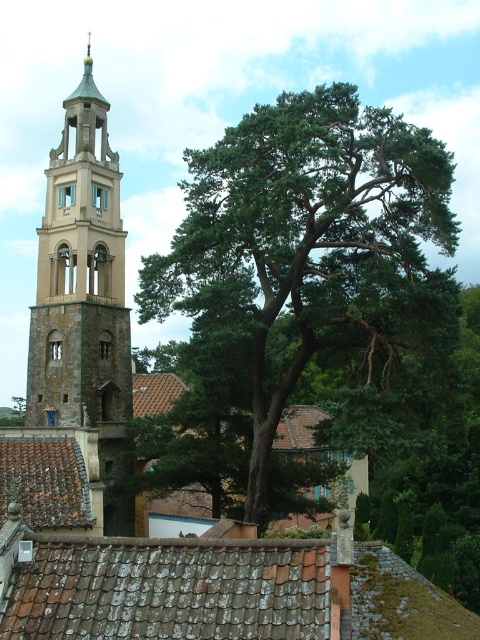
Is point (231, 205) farther from viewer compared to point (35, 348)?

That is False.

Who is more distant from viewer, [374,340] or [84,266]?

Point [84,266]

Who is more distant from viewer, (194, 323) or (35, 426)?

The point (35, 426) is more distant.

This screenshot has height=640, width=480. Identify the location of green leafy tree at center. (301, 252).

Which is more to the right, green leafy tree at center or brown tile roof at lower center?

brown tile roof at lower center is more to the right.

Does green leafy tree at center appear on the right side of brown tile roof at lower center?

In fact, green leafy tree at center is to the left of brown tile roof at lower center.

Which is behind, point (216, 196) or point (243, 588)?

The point (216, 196) is behind.

Image resolution: width=480 pixels, height=640 pixels. What are the coordinates of `green leafy tree at center` in the screenshot? It's located at (301, 252).

Does green leafy tree at center have a larger size compared to brown tile roof at lower left?

Indeed, green leafy tree at center has a larger size compared to brown tile roof at lower left.

Who is higher up, green leafy tree at center or brown tile roof at lower left?

green leafy tree at center

Where is `green leafy tree at center`? green leafy tree at center is located at coordinates (301, 252).

At what (x,y) coordinates should I click in order to perform the action: click on green leafy tree at center. Please return your answer as a coordinate pair (x, y). The width and height of the screenshot is (480, 640). Looking at the image, I should click on (301, 252).